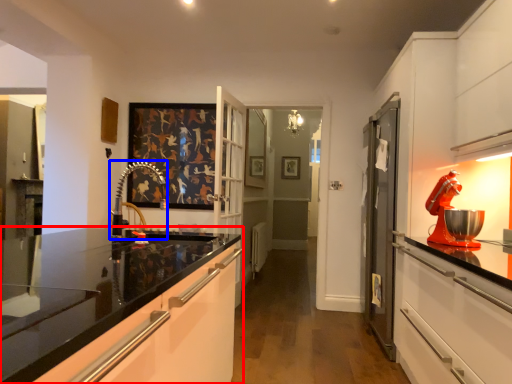
Question: Which object is further to the camera taking this photo, cabinetry (highlighted by a red box) or faucet (highlighted by a blue box)?

Choices:
 (A) cabinetry
 (B) faucet

Answer: (B)